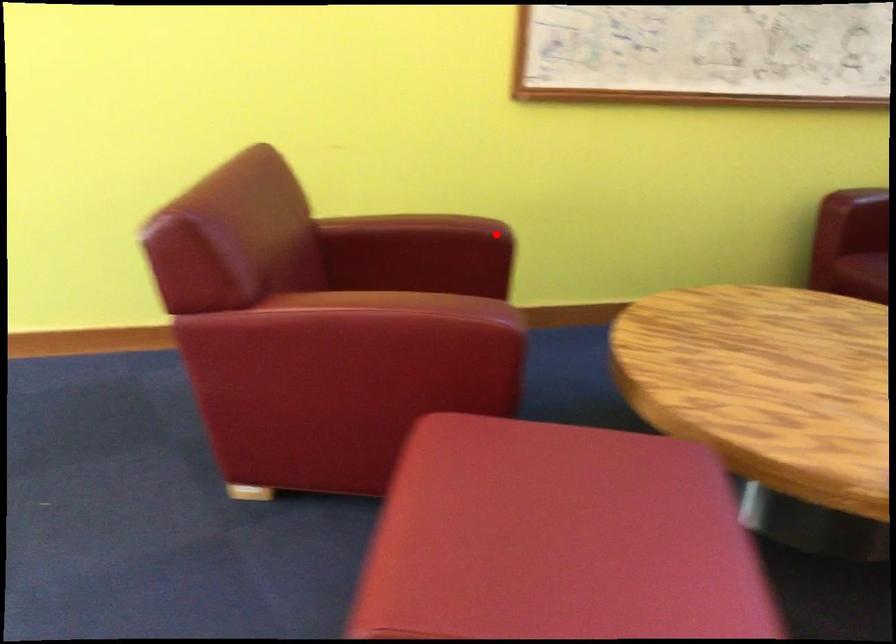
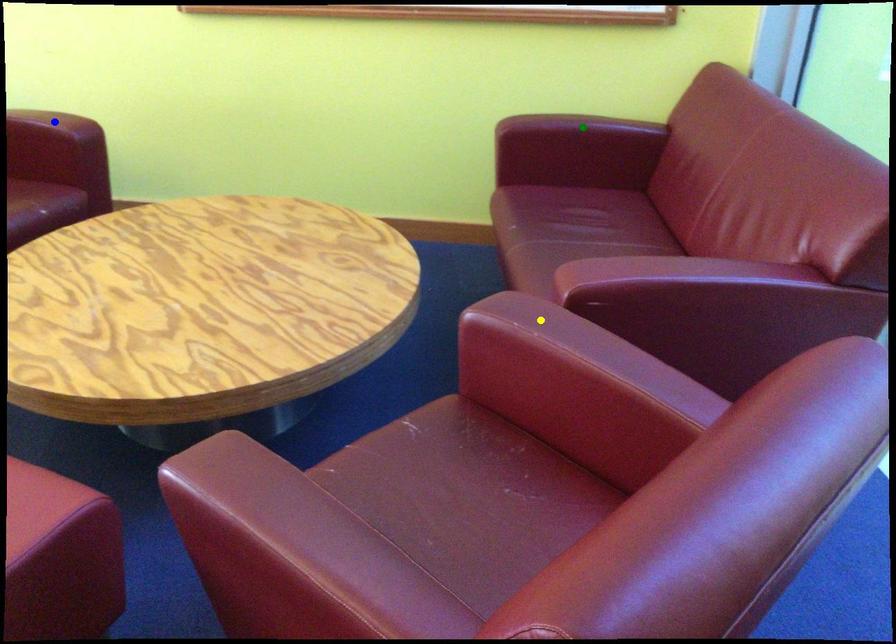
Question: I am providing you with two images of the same scene from different viewpoints. A red point is marked on the first image. You are given multiple points on the second image. Can you choose the point in image 2 that corresponds to the point in image 1?

Choices:
 (A) blue point
 (B) yellow point
 (C) green point

Answer: (A)